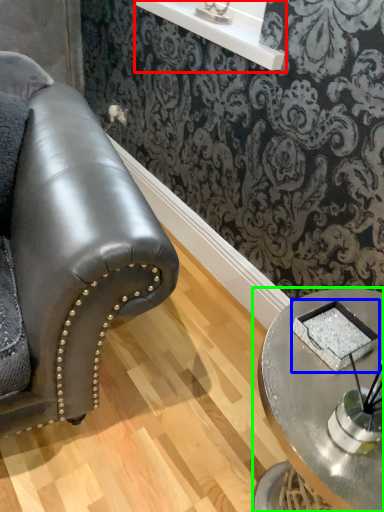
Question: Which is farther away from window sill (highlighted by a red box)? pad (highlighted by a blue box) or table (highlighted by a green box)?

Choices:
 (A) pad
 (B) table

Answer: (A)